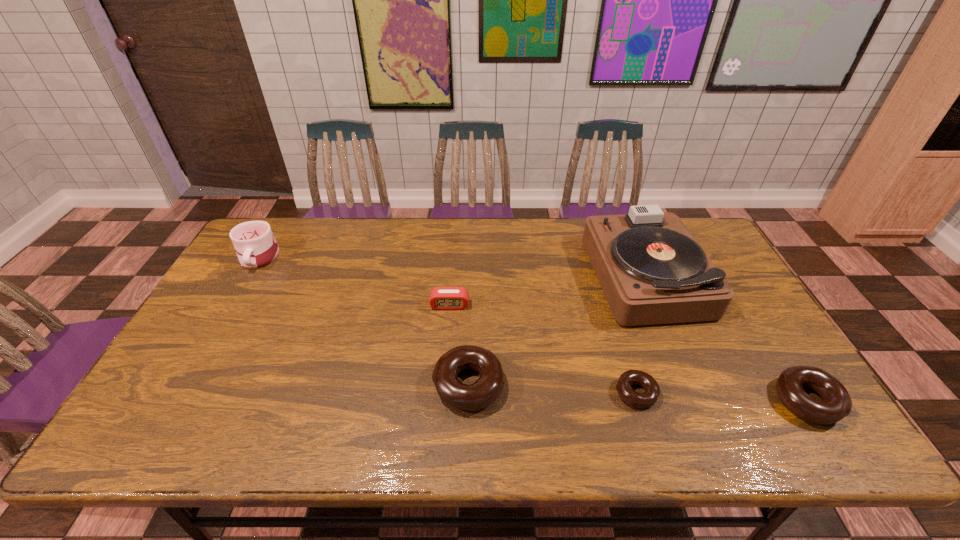
Please point a vacant point for placing a doughnut on the left. Please provide its 2D coordinates. Your answer should be formatted as a tuple, i.e. [(x, y)], where the tuple contains the x and y coordinates of a point satisfying the conditions above.

[(306, 378)]